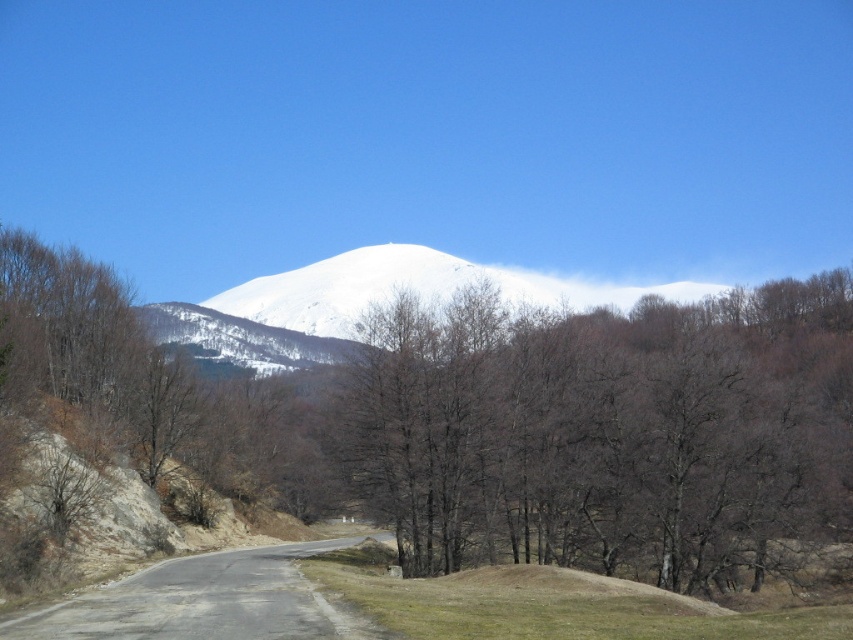
Question: Which point is farther to the camera?

Choices:
 (A) (846, 369)
 (B) (167, 620)

Answer: (A)

Question: Which object is farther from the camera taking this photo?

Choices:
 (A) brown/dry wood trees at center
 (B) white snow-covered mountain at center

Answer: (B)

Question: Can you confirm if brown/dry wood trees at center is positioned to the left of white snow-covered mountain at center?

Choices:
 (A) yes
 (B) no

Answer: (B)

Question: Is brown/dry wood trees at center to the right of gray asphalt road at lower left from the viewer's perspective?

Choices:
 (A) yes
 (B) no

Answer: (A)

Question: Which point appears farthest from the camera in this image?

Choices:
 (A) (47, 634)
 (B) (648, 316)
 (C) (256, 362)

Answer: (C)

Question: Can you confirm if white snow-covered mountain at center is smaller than gray asphalt road at lower left?

Choices:
 (A) yes
 (B) no

Answer: (B)